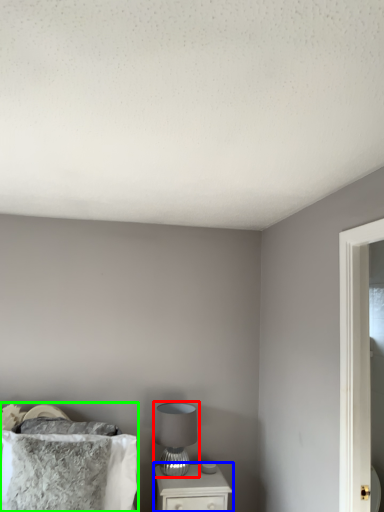
Question: Based on their relative distances, which object is nearer to table lamp (highlighted by a red box)? Choose from nightstand (highlighted by a blue box) and bed (highlighted by a green box).

Choices:
 (A) nightstand
 (B) bed

Answer: (A)